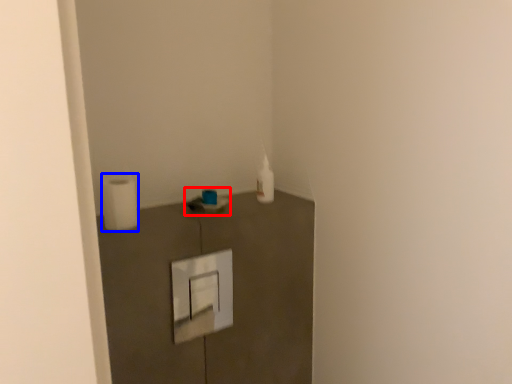
Question: Among these objects, which one is farthest to the camera, sink (highlighted by a red box) or toilet paper (highlighted by a blue box)?

Choices:
 (A) sink
 (B) toilet paper

Answer: (A)